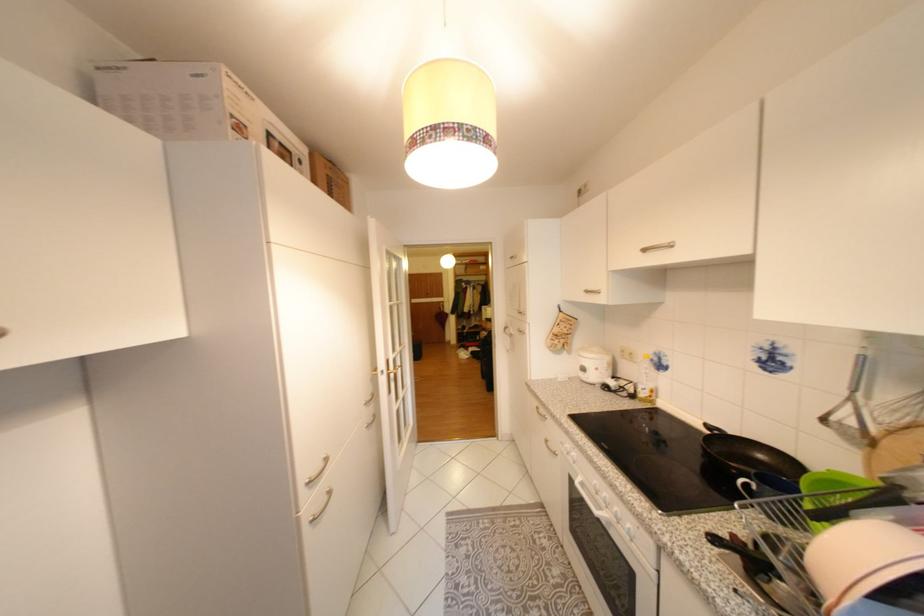
Find where to lift the white cardboard box. Please return your answer as a coordinate pair (x, y).

(187, 102)